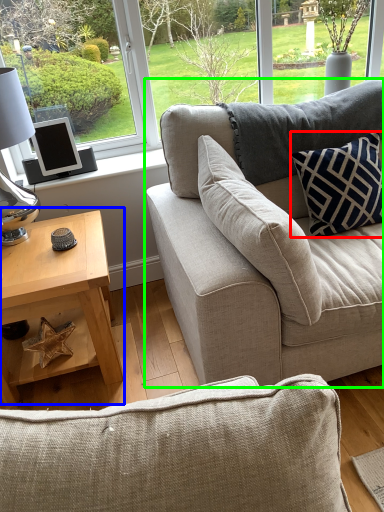
Question: Which is nearer to the pillow (highlighted by a red box)? coffee table (highlighted by a blue box) or studio couch (highlighted by a green box).

Choices:
 (A) coffee table
 (B) studio couch

Answer: (B)